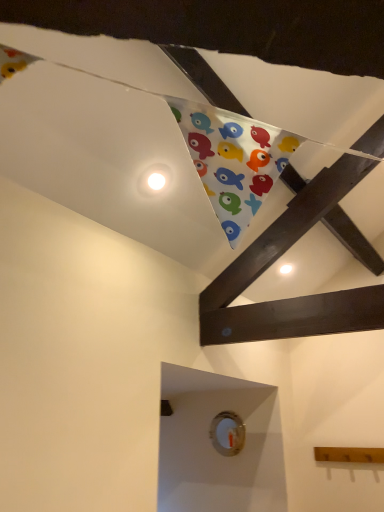
The width and height of the screenshot is (384, 512). In order to click on white plastic button at lower center, arranged as the second button when viewed from the front in this screenshot , I will do `click(227, 433)`.

In order to face white plastic button at lower center, arranged as the second button when viewed from the front, should I rotate leftwards or rightwards?

Turn right by 4.154 degrees to look at white plastic button at lower center, arranged as the second button when viewed from the front.

The width and height of the screenshot is (384, 512). What do you see at coordinates (227, 433) in the screenshot? I see `white plastic button at lower center, arranged as the second button when viewed from the front` at bounding box center [227, 433].

At what (x,y) coordinates should I click in order to perform the action: click on white matte button at upper center, which is counted as the 1th button, starting from the front. Please return your answer as a coordinate pair (x, y). Image resolution: width=384 pixels, height=512 pixels. Looking at the image, I should click on [154, 180].

This screenshot has width=384, height=512. Describe the element at coordinates (154, 180) in the screenshot. I see `white matte button at upper center, placed as the 2th button when sorted from back to front` at that location.

Where is `white plastic button at lower center, which is the second button from left to right`? This screenshot has width=384, height=512. white plastic button at lower center, which is the second button from left to right is located at coordinates (227, 433).

Which is more to the right, white plastic button at lower center, positioned as the 1th button in right-to-left order, or white matte button at upper center, which is counted as the 1th button, starting from the front?

Positioned to the right is white plastic button at lower center, positioned as the 1th button in right-to-left order.

Does white plastic button at lower center, which is the second button from left to right, come behind white matte button at upper center, the first button viewed from the top?

Yes.

Is point (215, 416) more distant than point (147, 184)?

Yes, point (215, 416) is behind point (147, 184).

From the image's perspective, which object appears higher, white plastic button at lower center, which is the second button from left to right, or white matte button at upper center, the second button from the bottom?

white matte button at upper center, the second button from the bottom, appears higher in the image.

From a real-world perspective, is white plastic button at lower center, arranged as the second button when viewed from the front, physically located above or below white matte button at upper center, the second button from the bottom?

From a real-world perspective, white plastic button at lower center, arranged as the second button when viewed from the front, is physically below white matte button at upper center, the second button from the bottom.

Based on the photo, which of these two, white plastic button at lower center, positioned as the 1th button in right-to-left order, or white matte button at upper center, which is the second button in right-to-left order, is wider?

white matte button at upper center, which is the second button in right-to-left order.

Which of these two, white plastic button at lower center, which is counted as the first button, starting from the bottom, or white matte button at upper center, placed as the 2th button when sorted from back to front, stands taller?

With more height is white plastic button at lower center, which is counted as the first button, starting from the bottom.

Which of these two, white plastic button at lower center, the 1th button in the back-to-front sequence, or white matte button at upper center, placed as the 2th button when sorted from back to front, is bigger?

white plastic button at lower center, the 1th button in the back-to-front sequence.

Is white plastic button at lower center, positioned as the 1th button in right-to-left order, situated inside white matte button at upper center, which is the second button in right-to-left order, or outside?

white plastic button at lower center, positioned as the 1th button in right-to-left order, is spatially situated outside white matte button at upper center, which is the second button in right-to-left order.

Is white plastic button at lower center, the 1th button in the back-to-front sequence, positioned far away from white matte button at upper center, placed as the 2th button when sorted from back to front?

Yes, white plastic button at lower center, the 1th button in the back-to-front sequence, is far from white matte button at upper center, placed as the 2th button when sorted from back to front.

Is white plastic button at lower center, arranged as the second button when viewed from the front, turned away from white matte button at upper center, placed as the 2th button when sorted from back to front?

No, white matte button at upper center, placed as the 2th button when sorted from back to front, is not at the back of white plastic button at lower center, arranged as the second button when viewed from the front.

How much distance is there between white plastic button at lower center, arranged as the second button when viewed from the front, and white matte button at upper center, the first button viewed from the top?

white plastic button at lower center, arranged as the second button when viewed from the front, and white matte button at upper center, the first button viewed from the top, are 1.89 meters apart.

At what (x,y) coordinates should I click in order to perform the action: click on button in front of the white plastic button at lower center, positioned as the 1th button in right-to-left order. Please return your answer as a coordinate pair (x, y). The width and height of the screenshot is (384, 512). Looking at the image, I should click on (154, 180).

Is white matte button at upper center, which is counted as the 1th button, starting from the front, at the right side of white plastic button at lower center, positioned as the 1th button in right-to-left order?

In fact, white matte button at upper center, which is counted as the 1th button, starting from the front, is to the left of white plastic button at lower center, positioned as the 1th button in right-to-left order.

Considering the positions of objects white matte button at upper center, the first button viewed from the top, and white plastic button at lower center, arranged as the second button when viewed from the front, in the image provided, who is in front, white matte button at upper center, the first button viewed from the top, or white plastic button at lower center, arranged as the second button when viewed from the front,?

white matte button at upper center, the first button viewed from the top.

Considering the points (138, 180) and (222, 433), which point is behind, point (138, 180) or point (222, 433)?

The point (222, 433) is farther.

From the image's perspective, which one is positioned higher, white matte button at upper center, the first button viewed from the top, or white plastic button at lower center, positioned as the 1th button in right-to-left order?

white matte button at upper center, the first button viewed from the top, appears higher in the image.

From a real-world perspective, is white matte button at upper center, the first button viewed from the top, physically below white plastic button at lower center, acting as the second button starting from the top?

No, from a real-world perspective, white matte button at upper center, the first button viewed from the top, is not under white plastic button at lower center, acting as the second button starting from the top.

Does white matte button at upper center, the first button viewed from the top, have a greater width compared to white plastic button at lower center, which is the second button from left to right?

Indeed, white matte button at upper center, the first button viewed from the top, has a greater width compared to white plastic button at lower center, which is the second button from left to right.

Can you confirm if white matte button at upper center, the first button viewed from the top, is taller than white plastic button at lower center, arranged as the second button when viewed from the front?

No, white matte button at upper center, the first button viewed from the top, is not taller than white plastic button at lower center, arranged as the second button when viewed from the front.

Considering the relative sizes of white matte button at upper center, the second button from the bottom, and white plastic button at lower center, acting as the second button starting from the top, in the image provided, is white matte button at upper center, the second button from the bottom, smaller than white plastic button at lower center, acting as the second button starting from the top,?

Yes, white matte button at upper center, the second button from the bottom, is smaller than white plastic button at lower center, acting as the second button starting from the top.

Would you say white matte button at upper center, placed as the 2th button when sorted from back to front, is inside or outside white plastic button at lower center, acting as the second button starting from the top?

white matte button at upper center, placed as the 2th button when sorted from back to front, is outside white plastic button at lower center, acting as the second button starting from the top.

Is white matte button at upper center, which is the second button in right-to-left order, next to white plastic button at lower center, which is the second button from left to right?

white matte button at upper center, which is the second button in right-to-left order, and white plastic button at lower center, which is the second button from left to right, are clearly separated.

Is white matte button at upper center, placed as the 2th button when sorted from back to front, turned away from white plastic button at lower center, positioned as the 1th button in right-to-left order?

That's not correct — white matte button at upper center, placed as the 2th button when sorted from back to front, is not looking away from white plastic button at lower center, positioned as the 1th button in right-to-left order.

How many degrees apart are the facing directions of white matte button at upper center, placed as the 2th button when sorted from back to front, and white plastic button at lower center, arranged as the second button when viewed from the front?

178 degrees.

Measure the distance from white matte button at upper center, the first button viewed from the top, to white plastic button at lower center, which is the second button from left to right.

white matte button at upper center, the first button viewed from the top, and white plastic button at lower center, which is the second button from left to right, are 1.89 meters apart from each other.

Find the location of `button above the white plastic button at lower center, positioned as the 1th button in right-to-left order (from the image's perspective)`. button above the white plastic button at lower center, positioned as the 1th button in right-to-left order (from the image's perspective) is located at coordinates 154,180.

The width and height of the screenshot is (384, 512). Find the location of `button that is above the white plastic button at lower center, acting as the second button starting from the top (from a real-world perspective)`. button that is above the white plastic button at lower center, acting as the second button starting from the top (from a real-world perspective) is located at coordinates (154, 180).

The image size is (384, 512). What are the coordinates of `button directly beneath the white matte button at upper center, the first button viewed from the top (from a real-world perspective)` in the screenshot? It's located at (227, 433).